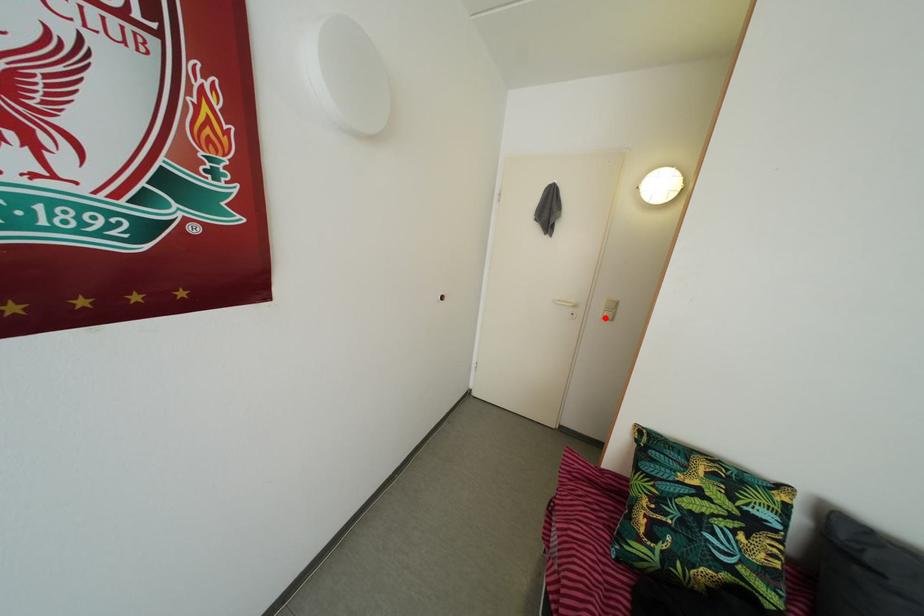
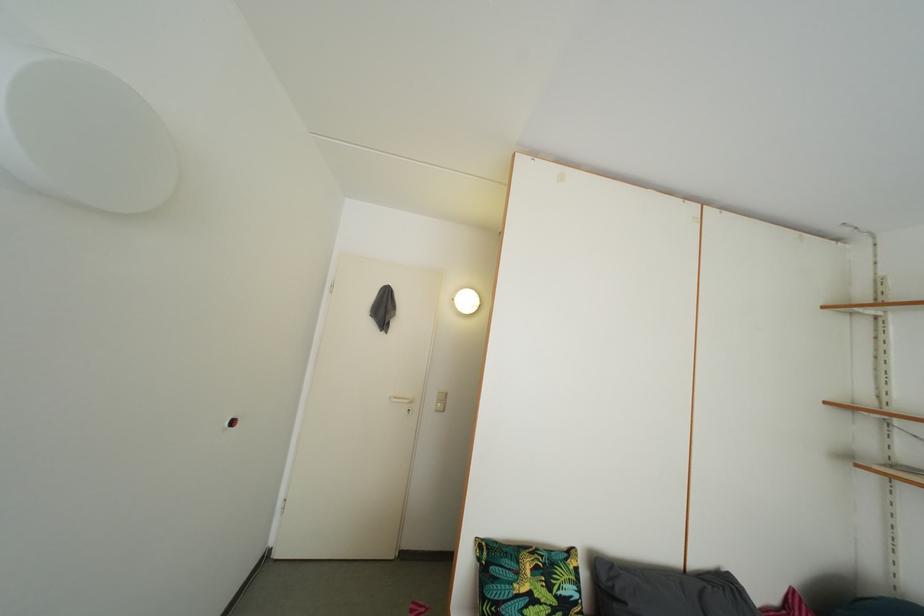
Find the pixel in the second image that matches the highlighted location in the first image.

(439, 411)